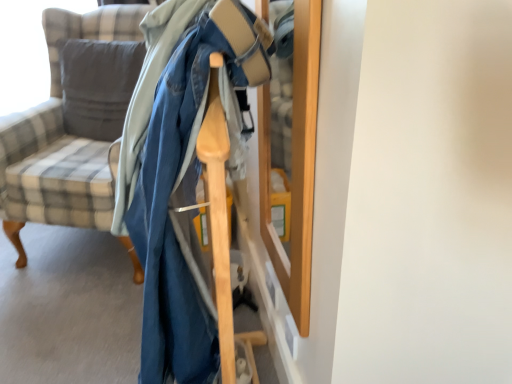
Question: From the image's perspective, relative to plaid fabric chair at left, is soft gray cushion at left above or below?

Choices:
 (A) above
 (B) below

Answer: (A)

Question: Based on their positions, is soft gray cushion at left located to the left or right of plaid fabric chair at left?

Choices:
 (A) left
 (B) right

Answer: (A)

Question: Considering the positions of soft gray cushion at left and plaid fabric chair at left in the image, is soft gray cushion at left wider or thinner than plaid fabric chair at left?

Choices:
 (A) wide
 (B) thin

Answer: (B)

Question: Based on their sizes in the image, would you say plaid fabric chair at left is bigger or smaller than soft gray cushion at left?

Choices:
 (A) small
 (B) big

Answer: (B)

Question: Do you think plaid fabric chair at left is within soft gray cushion at left, or outside of it?

Choices:
 (A) inside
 (B) outside

Answer: (B)

Question: In the image, is plaid fabric chair at left positioned in front of or behind soft gray cushion at left?

Choices:
 (A) behind
 (B) front

Answer: (B)

Question: From the image's perspective, relative to soft gray cushion at left, is plaid fabric chair at left above or below?

Choices:
 (A) below
 (B) above

Answer: (A)